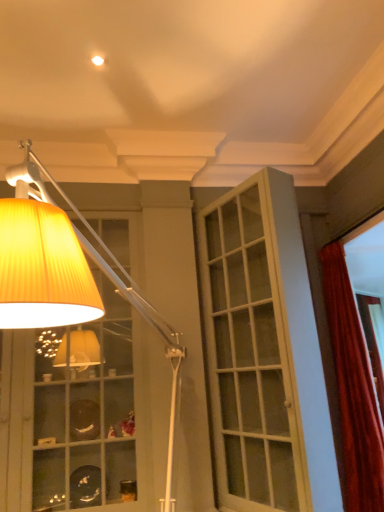
Question: Considering the relative positions of white glass door at center and yellow pleated lampshade at upper left in the image provided, is white glass door at center in front of yellow pleated lampshade at upper left?

Choices:
 (A) no
 (B) yes

Answer: (A)

Question: From the image's perspective, is white glass door at center below yellow pleated lampshade at upper left?

Choices:
 (A) yes
 (B) no

Answer: (A)

Question: Would you say white glass door at center is outside yellow pleated lampshade at upper left?

Choices:
 (A) yes
 (B) no

Answer: (A)

Question: Could yellow pleated lampshade at upper left be considered to be inside white glass door at center?

Choices:
 (A) yes
 (B) no

Answer: (B)

Question: Does white glass door at center have a greater width compared to yellow pleated lampshade at upper left?

Choices:
 (A) no
 (B) yes

Answer: (A)

Question: Considering the relative positions of white glass door at center and yellow pleated lampshade at upper left in the image provided, is white glass door at center to the right of yellow pleated lampshade at upper left from the viewer's perspective?

Choices:
 (A) no
 (B) yes

Answer: (B)

Question: Is yellow pleated lampshade at upper left facing away from velvet red curtain at right?

Choices:
 (A) no
 (B) yes

Answer: (A)

Question: Is yellow pleated lampshade at upper left far from velvet red curtain at right?

Choices:
 (A) no
 (B) yes

Answer: (B)

Question: From the image's perspective, is yellow pleated lampshade at upper left below velvet red curtain at right?

Choices:
 (A) yes
 (B) no

Answer: (B)

Question: Is yellow pleated lampshade at upper left directly adjacent to velvet red curtain at right?

Choices:
 (A) yes
 (B) no

Answer: (B)

Question: Can you confirm if yellow pleated lampshade at upper left is wider than velvet red curtain at right?

Choices:
 (A) yes
 (B) no

Answer: (A)

Question: Can you confirm if yellow pleated lampshade at upper left is shorter than velvet red curtain at right?

Choices:
 (A) yes
 (B) no

Answer: (A)

Question: Considering the relative sizes of yellow pleated lampshade at upper left and white glass door at center in the image provided, is yellow pleated lampshade at upper left shorter than white glass door at center?

Choices:
 (A) yes
 (B) no

Answer: (A)